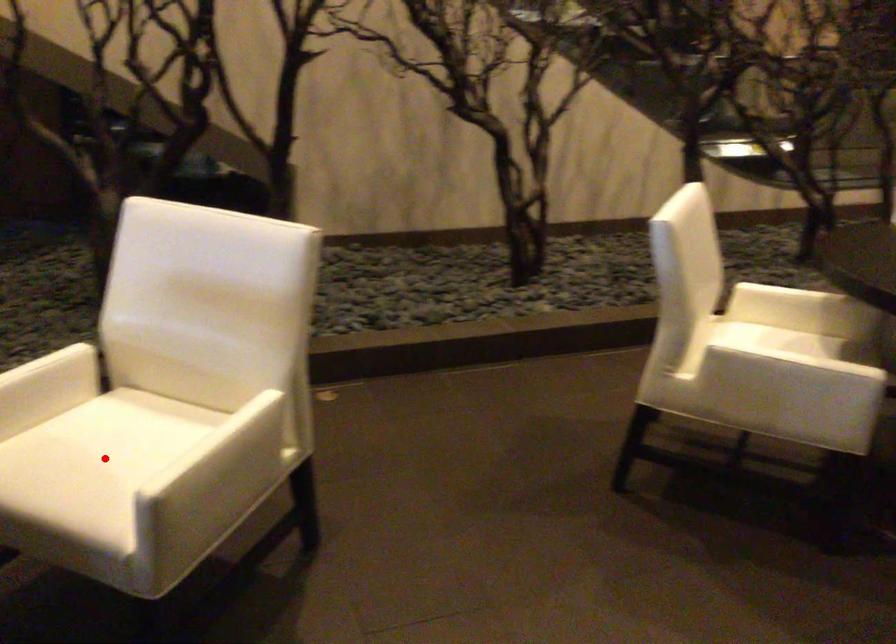
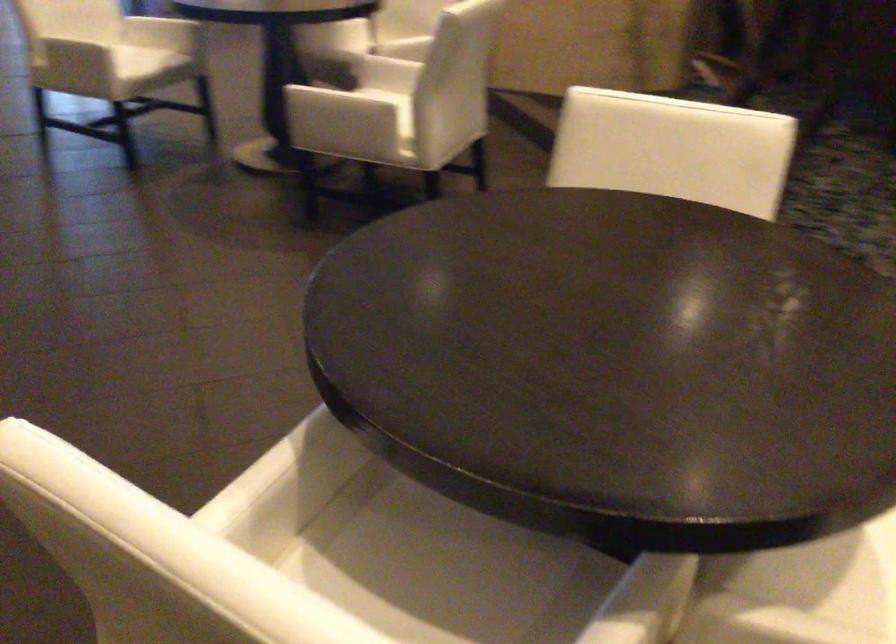
Question: I am providing you with two images of the same scene from different viewpoints. A red point is marked on the first image. At the location where the point appears in image 1, is it still visible in image 2?

Choices:
 (A) Yes
 (B) No

Answer: (B)